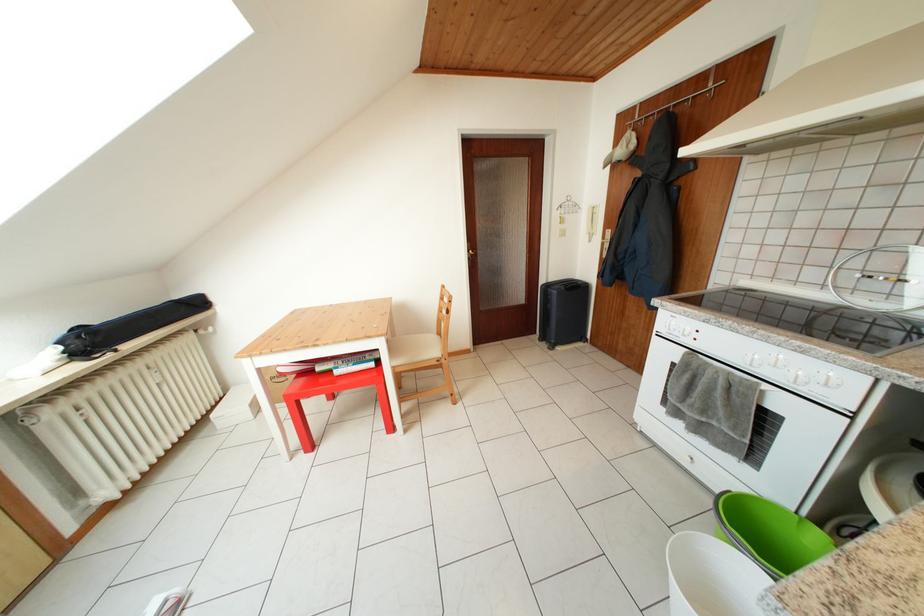
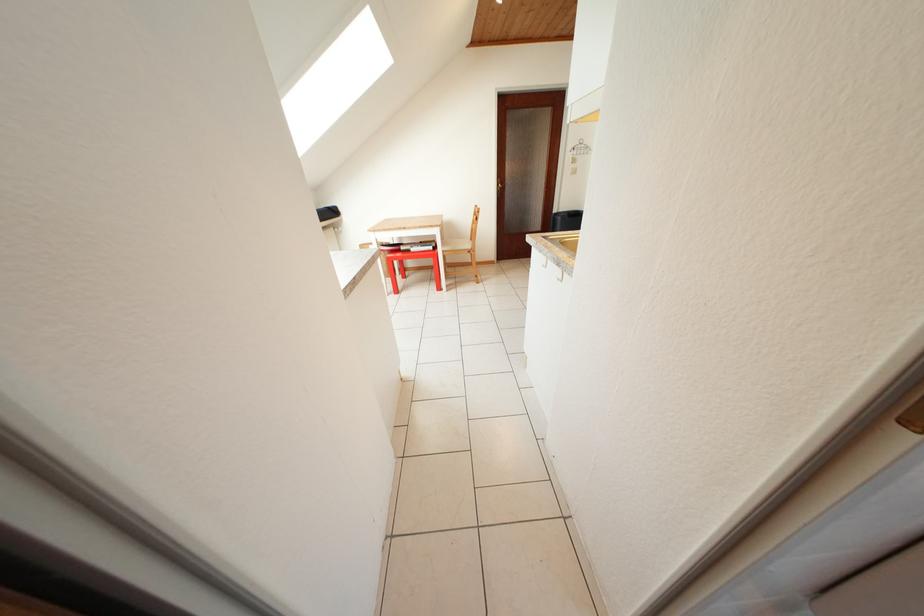
Question: What movement of the cameraman would produce the second image?

Choices:
 (A) Left
 (B) Right
 (C) Forward
 (D) Backward

Answer: (D)